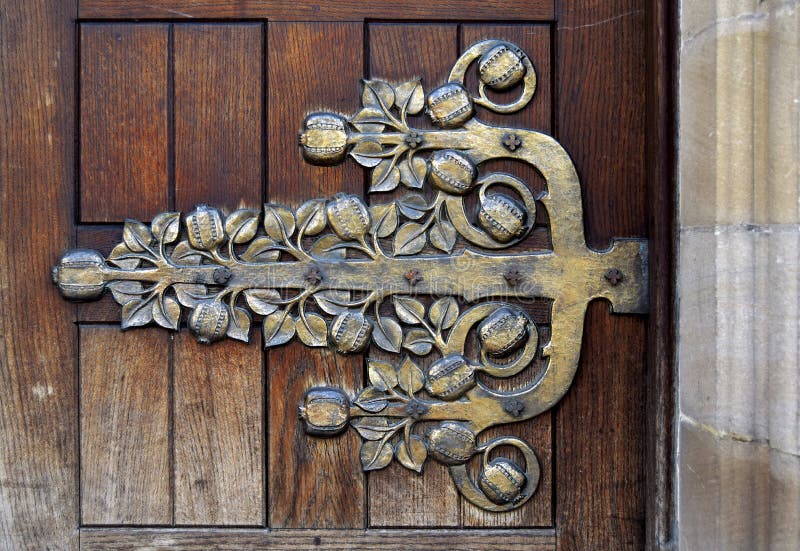
Identify the location of candlesticl. The image size is (800, 551). (541, 280).